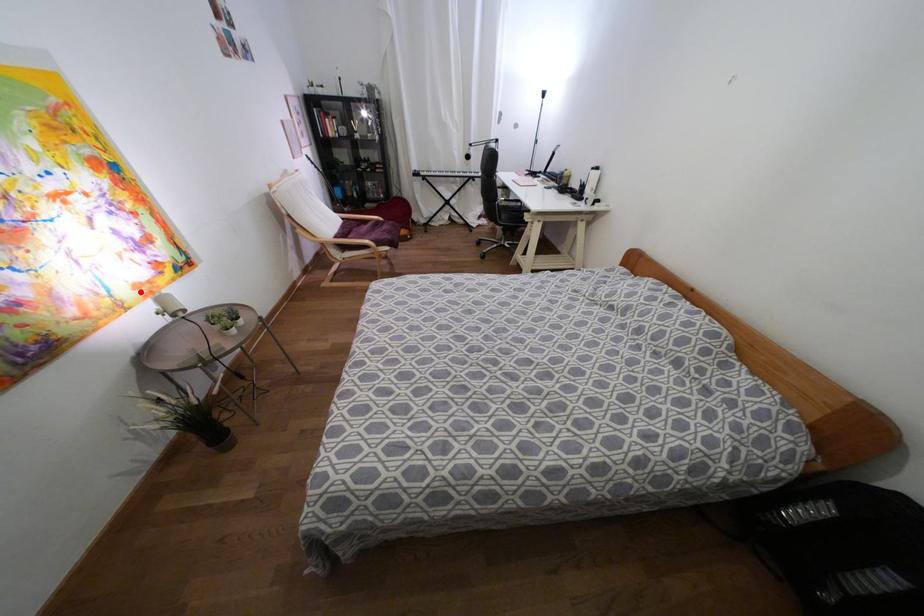
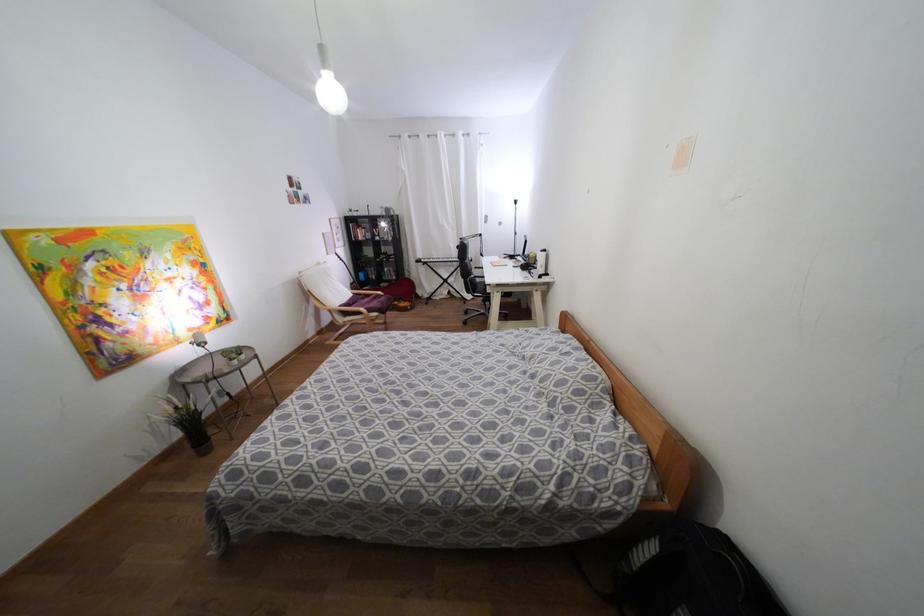
Locate, in the second image, the point that corresponds to the highlighted location in the first image.

(190, 333)